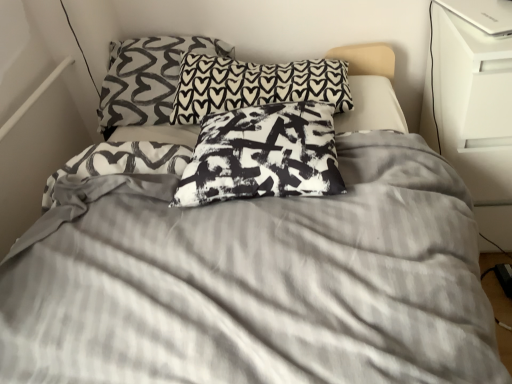
How much space does black printed pillow at upper center, acting as the 2th pillow starting from the back, occupy horizontally?

22.13 inches.

This screenshot has height=384, width=512. What do you see at coordinates (472, 114) in the screenshot?
I see `white glossy dresser at right` at bounding box center [472, 114].

What do you see at coordinates (147, 78) in the screenshot? I see `black printed pillow at upper center, which appears as the first pillow when viewed from the back` at bounding box center [147, 78].

The image size is (512, 384). Find the location of `black printed pillow at center, the first pillow in the front-to-back sequence`. black printed pillow at center, the first pillow in the front-to-back sequence is located at coordinates (263, 155).

Considering the sizes of black printed pillow at center, the first pillow in the front-to-back sequence, and white glossy dresser at right in the image, is black printed pillow at center, the first pillow in the front-to-back sequence, taller or shorter than white glossy dresser at right?

black printed pillow at center, the first pillow in the front-to-back sequence, is shorter than white glossy dresser at right.

Is black printed pillow at center, the 3th pillow positioned from the back, turned away from white glossy dresser at right?

No.

Which of these two, black printed pillow at center, the 3th pillow positioned from the back, or white glossy dresser at right, is bigger?

Bigger between the two is white glossy dresser at right.

Does black printed pillow at center, the first pillow in the front-to-back sequence, come behind white glossy dresser at right?

No, black printed pillow at center, the first pillow in the front-to-back sequence, is closer to the camera.

Considering their positions, is white glossy dresser at right located in front of or behind black printed pillow at upper center, which appears as the first pillow when viewed from the back?

white glossy dresser at right is in front of black printed pillow at upper center, which appears as the first pillow when viewed from the back.

How much distance is there between white glossy dresser at right and black printed pillow at upper center, which appears as the 3th pillow when viewed from the front?

The distance of white glossy dresser at right from black printed pillow at upper center, which appears as the 3th pillow when viewed from the front, is 89.07 centimeters.

From the image's perspective, between white glossy dresser at right and black printed pillow at upper center, which appears as the first pillow when viewed from the back, who is located below?

white glossy dresser at right is shown below in the image.

Which object is positioned more to the left, white glossy dresser at right or black printed pillow at upper center, which appears as the first pillow when viewed from the back?

From the viewer's perspective, black printed pillow at upper center, which appears as the first pillow when viewed from the back, appears more on the left side.

Considering the relative sizes of black printed pillow at upper center, which appears as the first pillow when viewed from the back, and black printed pillow at upper center, acting as the 2th pillow starting from the back, in the image provided, is black printed pillow at upper center, which appears as the first pillow when viewed from the back, taller than black printed pillow at upper center, acting as the 2th pillow starting from the back,?

Yes, black printed pillow at upper center, which appears as the first pillow when viewed from the back, is taller than black printed pillow at upper center, acting as the 2th pillow starting from the back.

From the image's perspective, would you say black printed pillow at upper center, which appears as the 3th pillow when viewed from the front, is positioned over black printed pillow at upper center, acting as the 2th pillow starting from the back?

Yes, from the image's perspective, black printed pillow at upper center, which appears as the 3th pillow when viewed from the front, is over black printed pillow at upper center, acting as the 2th pillow starting from the back.

Which is behind, point (114, 108) or point (286, 96)?

The point (114, 108) is more distant.

Is black printed pillow at upper center, which appears as the first pillow when viewed from the back, to the left of black printed pillow at upper center, acting as the 2th pillow starting from the back, from the viewer's perspective?

Yes, black printed pillow at upper center, which appears as the first pillow when viewed from the back, is to the left of black printed pillow at upper center, acting as the 2th pillow starting from the back.

In the scene shown: Which object is positioned more to the left, black printed pillow at center, the 3th pillow positioned from the back, or black printed pillow at upper center, acting as the 2th pillow starting from the back?

black printed pillow at upper center, acting as the 2th pillow starting from the back.

Is black printed pillow at center, the 3th pillow positioned from the back, outside of black printed pillow at upper center, acting as the second pillow starting from the front?

black printed pillow at center, the 3th pillow positioned from the back, lies outside black printed pillow at upper center, acting as the second pillow starting from the front,'s area.

Between black printed pillow at center, the 3th pillow positioned from the back, and black printed pillow at upper center, acting as the 2th pillow starting from the back, which one has smaller width?

Thinner between the two is black printed pillow at center, the 3th pillow positioned from the back.

Is black printed pillow at center, the 3th pillow positioned from the back, aimed at black printed pillow at upper center, acting as the 2th pillow starting from the back?

No, black printed pillow at center, the 3th pillow positioned from the back, does not turn towards black printed pillow at upper center, acting as the 2th pillow starting from the back.

Can you tell me how much black printed pillow at center, the 3th pillow positioned from the back, and black printed pillow at upper center, which appears as the first pillow when viewed from the back, differ in facing direction?

The facing directions of black printed pillow at center, the 3th pillow positioned from the back, and black printed pillow at upper center, which appears as the first pillow when viewed from the back, are 2.43 degrees apart.

Are black printed pillow at center, the 3th pillow positioned from the back, and black printed pillow at upper center, which appears as the 3th pillow when viewed from the front, located far from each other?

No, there isn't a large distance between black printed pillow at center, the 3th pillow positioned from the back, and black printed pillow at upper center, which appears as the 3th pillow when viewed from the front.

In the image, is black printed pillow at center, the first pillow in the front-to-back sequence, positioned in front of or behind black printed pillow at upper center, which appears as the 3th pillow when viewed from the front?

Clearly, black printed pillow at center, the first pillow in the front-to-back sequence, is in front of black printed pillow at upper center, which appears as the 3th pillow when viewed from the front.

At what (x,y) coordinates should I click in order to perform the action: click on the 1st pillow below the black printed pillow at upper center, which appears as the 3th pillow when viewed from the front (from a real-world perspective). Please return your answer as a coordinate pair (x, y). The width and height of the screenshot is (512, 384). Looking at the image, I should click on (263, 155).

From the image's perspective, relative to black printed pillow at center, the 3th pillow positioned from the back, is black printed pillow at upper center, acting as the 2th pillow starting from the back, above or below?

From the image's perspective, black printed pillow at upper center, acting as the 2th pillow starting from the back, appears above black printed pillow at center, the 3th pillow positioned from the back.

Considering the positions of objects black printed pillow at upper center, acting as the second pillow starting from the front, and black printed pillow at center, the 3th pillow positioned from the back, in the image provided, who is more to the left, black printed pillow at upper center, acting as the second pillow starting from the front, or black printed pillow at center, the 3th pillow positioned from the back,?

Positioned to the left is black printed pillow at upper center, acting as the second pillow starting from the front.

From a real-world perspective, which object rests below the other?

black printed pillow at upper center, acting as the second pillow starting from the front, from a real-world perspective.

Can you tell me how much white glossy dresser at right and black printed pillow at upper center, acting as the second pillow starting from the front, differ in facing direction?

The angular difference between white glossy dresser at right and black printed pillow at upper center, acting as the second pillow starting from the front, is 92.4 degrees.

Is white glossy dresser at right bigger than black printed pillow at upper center, acting as the second pillow starting from the front?

Yes, white glossy dresser at right is bigger than black printed pillow at upper center, acting as the second pillow starting from the front.

Is white glossy dresser at right completely or partially outside of black printed pillow at upper center, acting as the 2th pillow starting from the back?

Absolutely, white glossy dresser at right is external to black printed pillow at upper center, acting as the 2th pillow starting from the back.

This screenshot has height=384, width=512. What are the coordinates of `dresser lying on the right of black printed pillow at center, the first pillow in the front-to-back sequence` in the screenshot? It's located at (472, 114).

Where is `the 3rd pillow directly above the white glossy dresser at right (from a real-world perspective)`? the 3rd pillow directly above the white glossy dresser at right (from a real-world perspective) is located at coordinates (147, 78).

Looking at the image, which one is located closer to black printed pillow at upper center, which appears as the 3th pillow when viewed from the front, black printed pillow at upper center, acting as the 2th pillow starting from the back, or black printed pillow at center, the first pillow in the front-to-back sequence?

black printed pillow at upper center, acting as the 2th pillow starting from the back.

Based on the photo, based on their spatial positions, is black printed pillow at upper center, acting as the second pillow starting from the front, or black printed pillow at upper center, which appears as the 3th pillow when viewed from the front, closer to black printed pillow at center, the 3th pillow positioned from the back?

black printed pillow at upper center, acting as the second pillow starting from the front, lies closer to black printed pillow at center, the 3th pillow positioned from the back, than the other object.

Looking at this image, when comparing their distances from white glossy dresser at right, does black printed pillow at center, the 3th pillow positioned from the back, or black printed pillow at upper center, acting as the 2th pillow starting from the back, seem further?

black printed pillow at center, the 3th pillow positioned from the back, is positioned further to the anchor white glossy dresser at right.

Looking at the image, which one is located closer to white glossy dresser at right, black printed pillow at upper center, acting as the 2th pillow starting from the back, or black printed pillow at upper center, which appears as the 3th pillow when viewed from the front?

Based on the image, black printed pillow at upper center, acting as the 2th pillow starting from the back, appears to be nearer to white glossy dresser at right.

Based on their spatial positions, is white glossy dresser at right or black printed pillow at upper center, acting as the second pillow starting from the front, closer to black printed pillow at center, the first pillow in the front-to-back sequence?

The object closer to black printed pillow at center, the first pillow in the front-to-back sequence, is black printed pillow at upper center, acting as the second pillow starting from the front.

Estimate the real-world distances between objects in this image. Which object is further from black printed pillow at upper center, acting as the 2th pillow starting from the back, black printed pillow at center, the first pillow in the front-to-back sequence, or black printed pillow at upper center, which appears as the 3th pillow when viewed from the front?

black printed pillow at center, the first pillow in the front-to-back sequence, is positioned further to the anchor black printed pillow at upper center, acting as the 2th pillow starting from the back.

When comparing their distances from black printed pillow at center, the first pillow in the front-to-back sequence, does white glossy dresser at right or black printed pillow at upper center, which appears as the 3th pillow when viewed from the front, seem closer?

Among the two, white glossy dresser at right is located nearer to black printed pillow at center, the first pillow in the front-to-back sequence.

From the image, which object appears to be farther from black printed pillow at center, the first pillow in the front-to-back sequence, black printed pillow at upper center, which appears as the 3th pillow when viewed from the front, or black printed pillow at upper center, acting as the 2th pillow starting from the back?

Based on the image, black printed pillow at upper center, which appears as the 3th pillow when viewed from the front, appears to be further to black printed pillow at center, the first pillow in the front-to-back sequence.

The height and width of the screenshot is (384, 512). Find the location of `pillow between black printed pillow at upper center, acting as the 2th pillow starting from the back, and white glossy dresser at right, in the horizontal direction`. pillow between black printed pillow at upper center, acting as the 2th pillow starting from the back, and white glossy dresser at right, in the horizontal direction is located at coordinates (263, 155).

I want to click on pillow between black printed pillow at center, the 3th pillow positioned from the back, and black printed pillow at upper center, which appears as the first pillow when viewed from the back, along the z-axis, so click(255, 85).